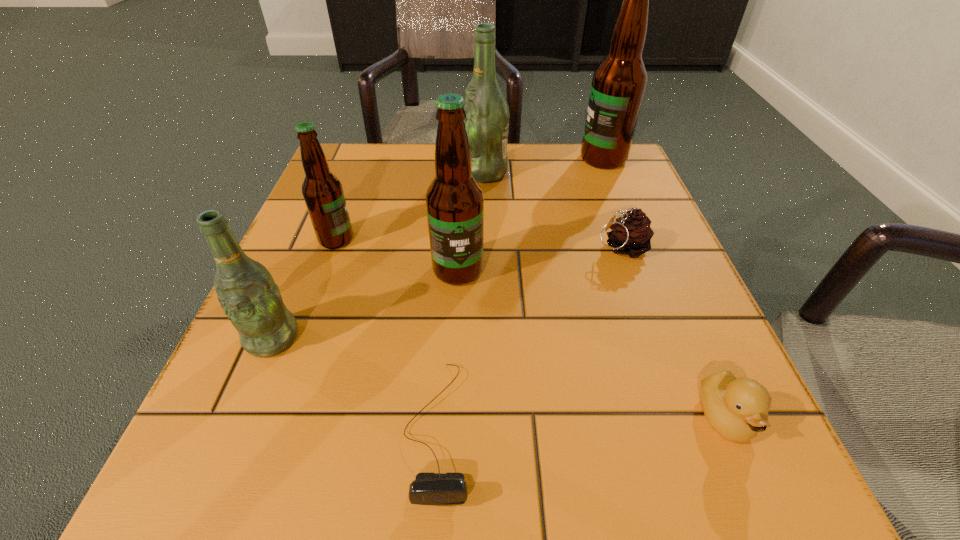
Where is `free area in between the smaller green beer bottle and the second brown beer bottle from left to right`? free area in between the smaller green beer bottle and the second brown beer bottle from left to right is located at coordinates (365, 304).

The width and height of the screenshot is (960, 540). I want to click on vacant space in between the webcam and the nearest beer bottle, so pyautogui.click(x=355, y=383).

Locate an element on the screen. This screenshot has width=960, height=540. empty space that is in between the shortest object and the duckling is located at coordinates (581, 423).

This screenshot has width=960, height=540. I want to click on vacant region between the second brown beer bottle from right to left and the rightmost beer bottle, so click(x=531, y=215).

In order to click on free area in between the second brown beer bottle from right to left and the smallest brown beer bottle in this screenshot , I will do `click(397, 255)`.

Locate an element on the screen. blank region between the sixth farthest object and the shortest object is located at coordinates (355, 383).

Point out which object is positioned as the second nearest to the nearest brown beer bottle. Please provide its 2D coordinates. Your answer should be formatted as a tuple, i.e. [(x, y)], where the tuple contains the x and y coordinates of a point satisfying the conditions above.

[(322, 191)]

Where is `the second closest object to the right green beer bottle`? This screenshot has width=960, height=540. the second closest object to the right green beer bottle is located at coordinates (631, 234).

The image size is (960, 540). I want to click on beer bottle that is the fourth closest to the left green beer bottle, so click(x=618, y=85).

Where is `beer bottle that is the third closest to the duckling`? This screenshot has height=540, width=960. beer bottle that is the third closest to the duckling is located at coordinates (246, 290).